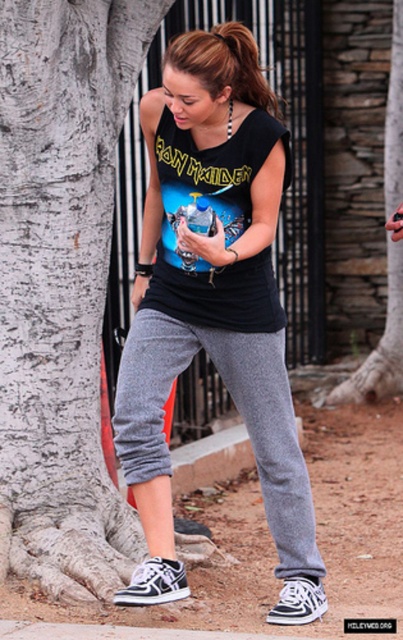
Is heathered gray sweatpants at lower center positioned in front of matte black tank top at center?

That is False.

The width and height of the screenshot is (403, 640). In order to click on heathered gray sweatpants at lower center in this screenshot , I will do `click(238, 412)`.

Is black cotton tank top at center taller than matte black tank top at center?

Indeed, black cotton tank top at center has a greater height compared to matte black tank top at center.

Who is taller, black cotton tank top at center or matte black tank top at center?

black cotton tank top at center is taller.

Does point (238, 164) lie in front of point (168, 176)?

That is True.

Identify the location of black cotton tank top at center. The width and height of the screenshot is (403, 640). (213, 305).

Is gray bark tree trunk at right to the left of heathered gray sweatpants at lower center from the viewer's perspective?

In fact, gray bark tree trunk at right is to the right of heathered gray sweatpants at lower center.

Can you confirm if gray bark tree trunk at right is shorter than heathered gray sweatpants at lower center?

No.

Does point (400, 372) come behind point (243, 337)?

Yes, it is behind point (243, 337).

Identify the location of gray bark tree trunk at right. (365, 186).